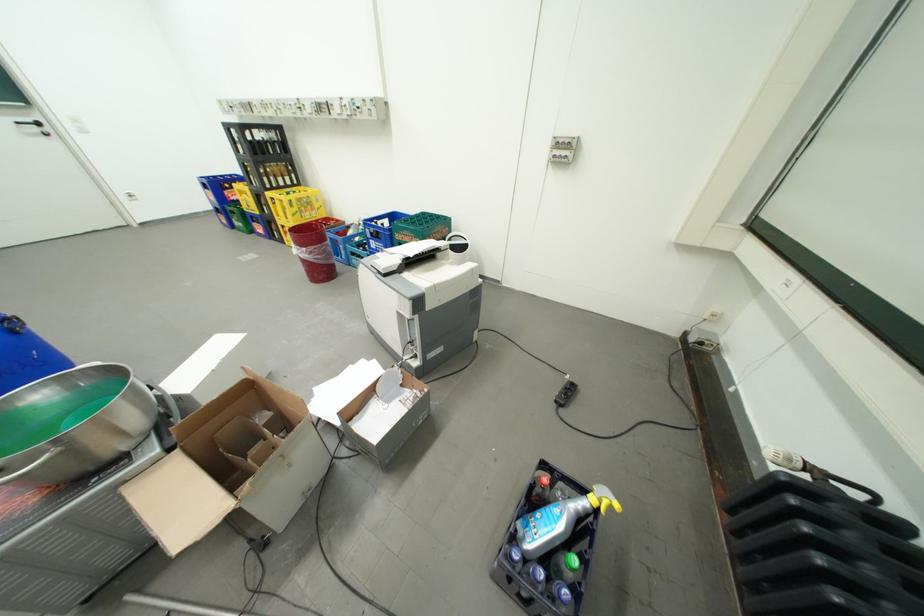
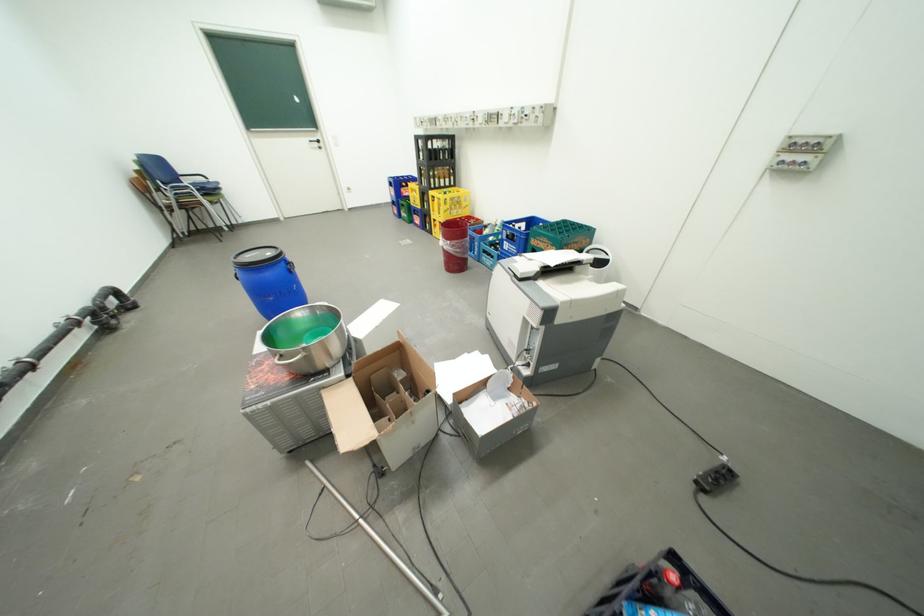
Question: I am providing you with two images of the same scene from different viewpoints. After the viewpoint changes to image2, which objects are now occluded?

Choices:
 (A) blue bottle crate
 (B) yellow bottle crate
 (C) cardboard box
 (D) none of these

Answer: (D)